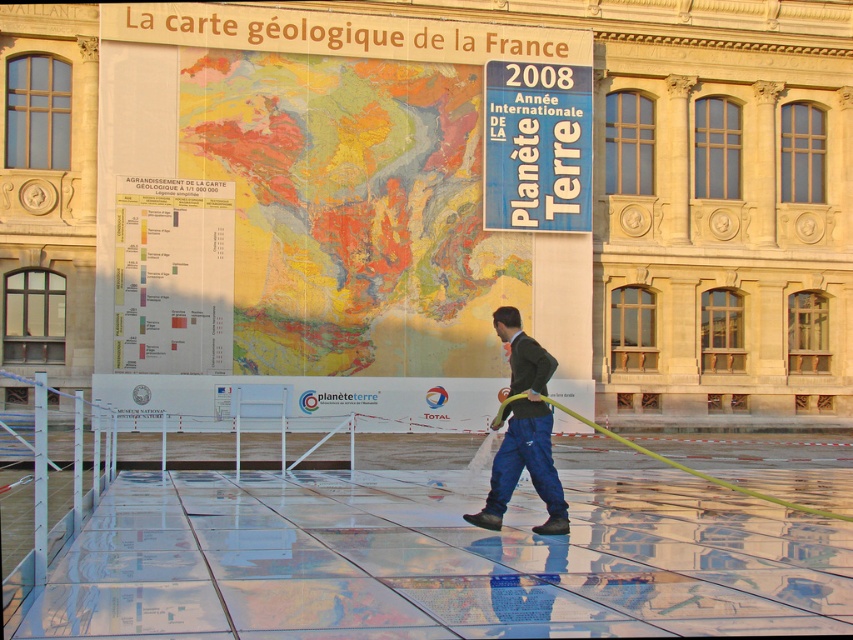
Is dark green sweater at center further to the viewer compared to green rubber hose at center?

That is True.

Is point (496, 476) more distant than point (602, 433)?

No, (496, 476) is in front of (602, 433).

Where is `dark green sweater at center`? This screenshot has width=853, height=640. dark green sweater at center is located at coordinates (523, 432).